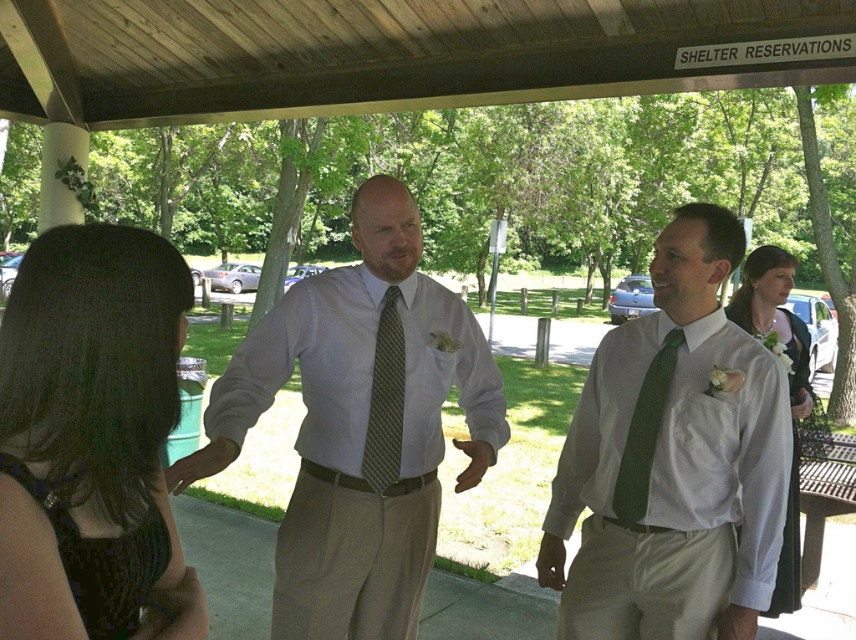
Question: Estimate the real-world distances between objects in this image. Which object is closer to the white satin dress at center?

Choices:
 (A) black satin dress at left
 (B) white dress shirt at center

Answer: (B)

Question: Among these objects, which one is farthest from the camera?

Choices:
 (A) green dotted tie at center
 (B) matte green tie at center
 (C) white dress shirt at center
 (D) white satin dress at center

Answer: (D)

Question: Does white cotton shirt at center have a greater width compared to white satin dress at center?

Choices:
 (A) yes
 (B) no

Answer: (A)

Question: Does white cotton shirt at center appear over green dotted tie at center?

Choices:
 (A) yes
 (B) no

Answer: (B)

Question: Can you confirm if green dotted tie at center is thinner than green textured tie at center?

Choices:
 (A) yes
 (B) no

Answer: (A)

Question: Which point appears closest to the camera in this image?

Choices:
 (A) (45, 593)
 (B) (417, 547)
 (C) (396, 420)

Answer: (A)